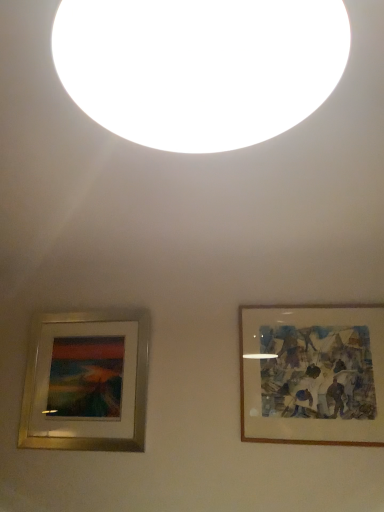
Question: Is gold metallic picture frame at lower left, the second picture frame positioned from the right, at the left side of white matte light at upper center?

Choices:
 (A) yes
 (B) no

Answer: (A)

Question: Is gold metallic picture frame at lower left, which appears as the 1th picture frame when viewed from the left, not close to white matte light at upper center?

Choices:
 (A) yes
 (B) no

Answer: (A)

Question: Considering the relative sizes of gold metallic picture frame at lower left, the second picture frame positioned from the right, and white matte light at upper center in the image provided, is gold metallic picture frame at lower left, the second picture frame positioned from the right, bigger than white matte light at upper center?

Choices:
 (A) yes
 (B) no

Answer: (B)

Question: Is gold metallic picture frame at lower left, the second picture frame positioned from the right, outside white matte light at upper center?

Choices:
 (A) yes
 (B) no

Answer: (A)

Question: Is gold metallic picture frame at lower left, which appears as the 1th picture frame when viewed from the left, thinner than white matte light at upper center?

Choices:
 (A) yes
 (B) no

Answer: (A)

Question: Does point (284, 387) appear closer or farther from the camera than point (213, 117)?

Choices:
 (A) farther
 (B) closer

Answer: (A)

Question: In terms of size, does wooden frame at right, which appears as the 2th picture frame when viewed from the left, appear bigger or smaller than white matte light at upper center?

Choices:
 (A) big
 (B) small

Answer: (B)

Question: From a real-world perspective, is wooden frame at right, the first picture frame in the right-to-left sequence, positioned above or below white matte light at upper center?

Choices:
 (A) below
 (B) above

Answer: (A)

Question: Is wooden frame at right, the first picture frame in the right-to-left sequence, situated inside white matte light at upper center or outside?

Choices:
 (A) outside
 (B) inside

Answer: (A)

Question: From the image's perspective, relative to wooden frame at right, the first picture frame in the right-to-left sequence, is white matte light at upper center above or below?

Choices:
 (A) below
 (B) above

Answer: (B)

Question: Would you say white matte light at upper center is to the left or to the right of wooden frame at right, the first picture frame in the right-to-left sequence, in the picture?

Choices:
 (A) left
 (B) right

Answer: (A)

Question: Looking at their shapes, would you say white matte light at upper center is wider or thinner than wooden frame at right, which appears as the 2th picture frame when viewed from the left?

Choices:
 (A) thin
 (B) wide

Answer: (B)

Question: In terms of size, does white matte light at upper center appear bigger or smaller than wooden frame at right, the first picture frame in the right-to-left sequence?

Choices:
 (A) small
 (B) big

Answer: (B)

Question: In terms of height, does gold metallic picture frame at lower left, which appears as the 1th picture frame when viewed from the left, look taller or shorter compared to wooden frame at right, which appears as the 2th picture frame when viewed from the left?

Choices:
 (A) tall
 (B) short

Answer: (A)

Question: Considering their positions, is gold metallic picture frame at lower left, which appears as the 1th picture frame when viewed from the left, located in front of or behind wooden frame at right, the first picture frame in the right-to-left sequence?

Choices:
 (A) front
 (B) behind

Answer: (B)